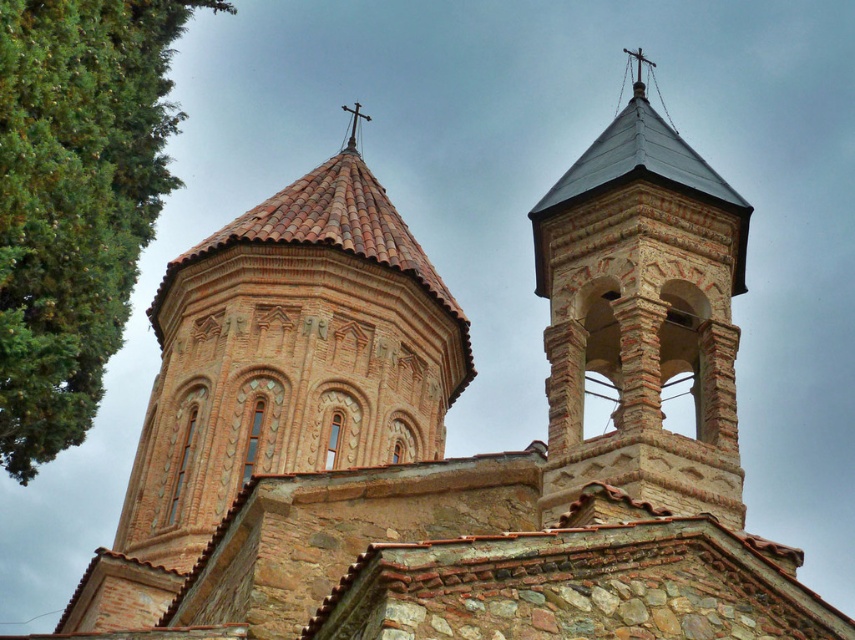
Is green leafy tree at left smaller than brown stone bell tower at upper right?

Actually, green leafy tree at left might be larger than brown stone bell tower at upper right.

Who is taller, green leafy tree at left or brown stone bell tower at upper right?

Standing taller between the two is green leafy tree at left.

Where is `green leafy tree at left`? green leafy tree at left is located at coordinates (75, 200).

Where is `green leafy tree at left`? The image size is (855, 640). green leafy tree at left is located at coordinates [75, 200].